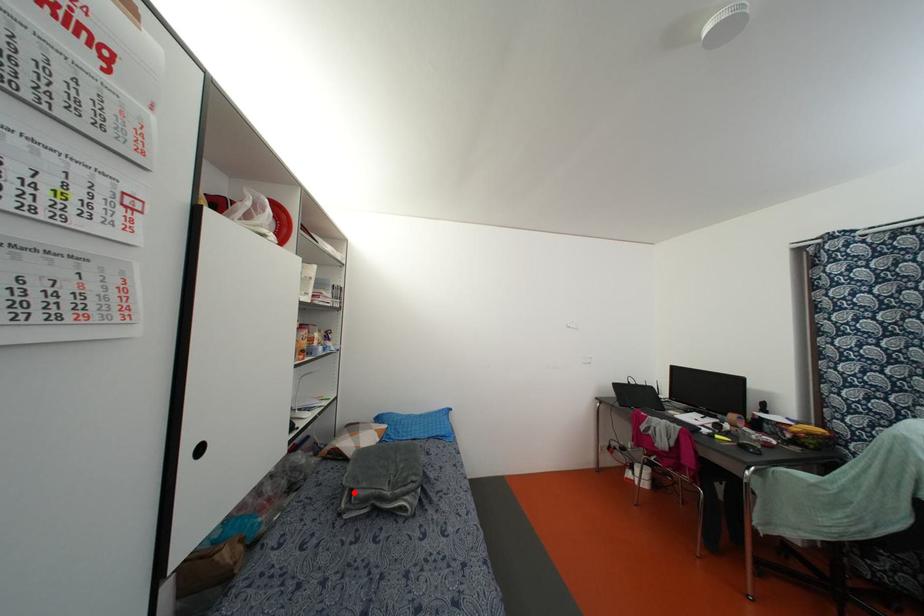
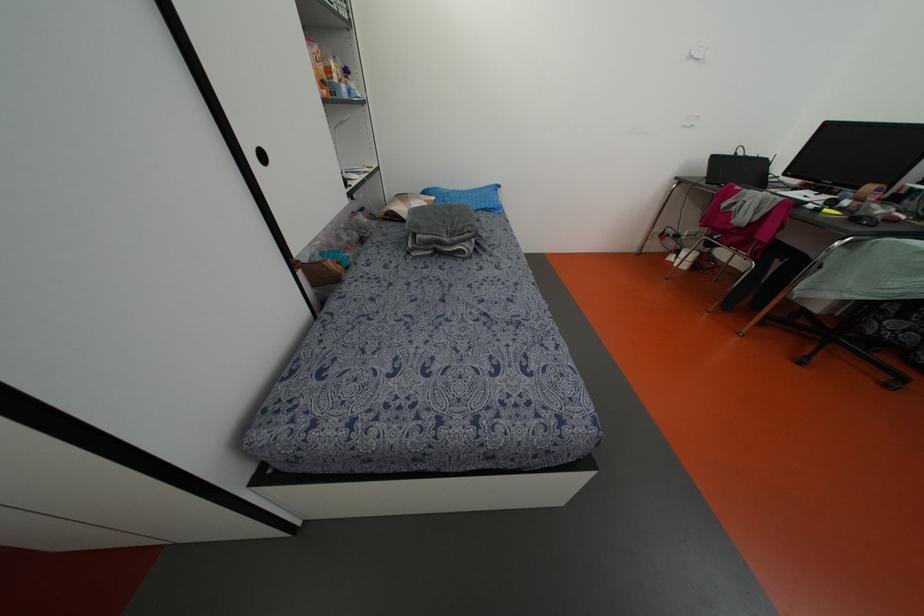
Locate, in the second image, the point that corresponds to the highlighted location in the first image.

(418, 236)